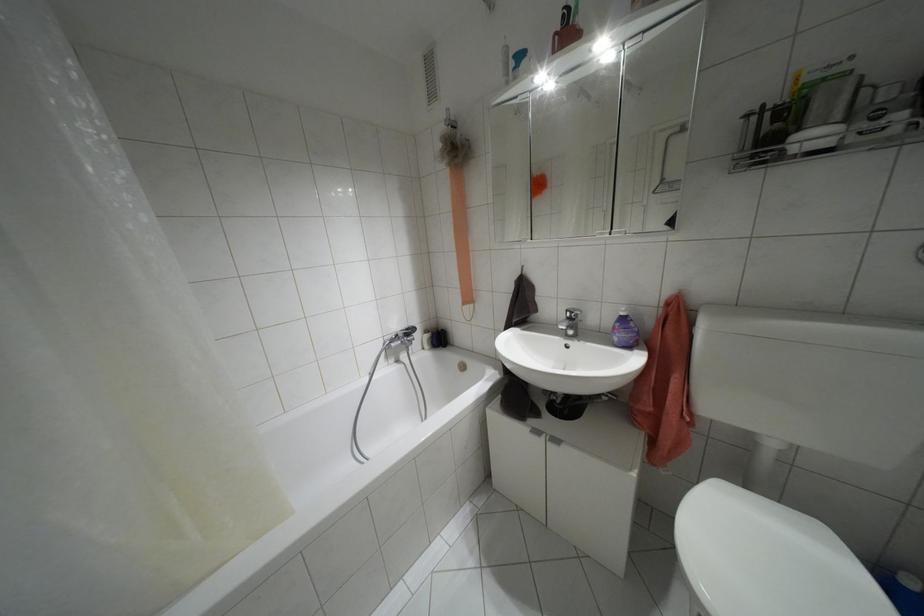
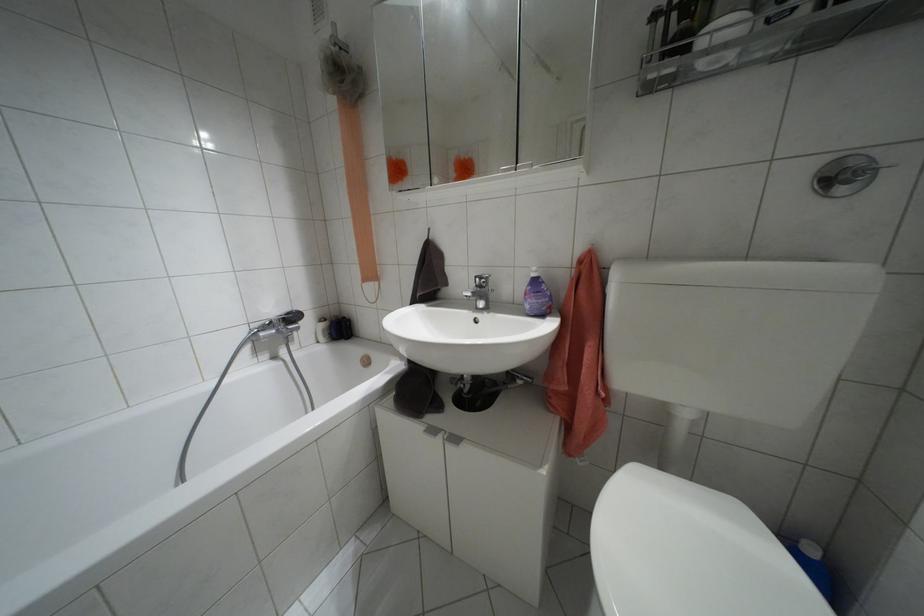
Find the pixel in the second image that matches point (672, 546) in the first image.

(590, 554)